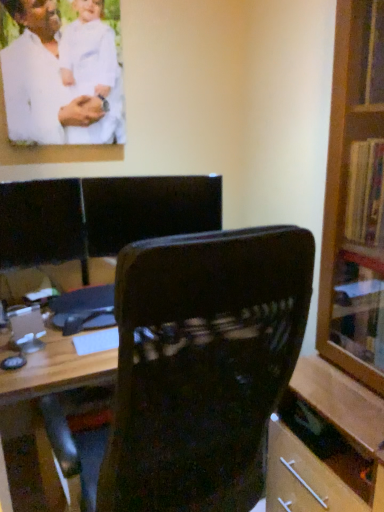
Question: Is white matte shirt at upper left taller than velvet-like dark brown chair at center?

Choices:
 (A) no
 (B) yes

Answer: (A)

Question: Is white matte shirt at upper left located outside velvet-like dark brown chair at center?

Choices:
 (A) no
 (B) yes

Answer: (B)

Question: Can you confirm if white matte shirt at upper left is shorter than velvet-like dark brown chair at center?

Choices:
 (A) no
 (B) yes

Answer: (B)

Question: From the image's perspective, is white matte shirt at upper left on top of velvet-like dark brown chair at center?

Choices:
 (A) no
 (B) yes

Answer: (B)

Question: Is white matte shirt at upper left positioned in front of velvet-like dark brown chair at center?

Choices:
 (A) no
 (B) yes

Answer: (A)

Question: Is black leather chair at center situated inside white matte shirt at upper left or outside?

Choices:
 (A) outside
 (B) inside

Answer: (A)

Question: Does point (210, 227) appear closer or farther from the camera than point (41, 33)?

Choices:
 (A) farther
 (B) closer

Answer: (A)

Question: From their relative heights in the image, would you say black leather chair at center is taller or shorter than white matte shirt at upper left?

Choices:
 (A) short
 (B) tall

Answer: (A)

Question: Is black leather chair at center bigger or smaller than white matte shirt at upper left?

Choices:
 (A) small
 (B) big

Answer: (B)

Question: Considering the positions of black leather chair at center and velvet-like dark brown chair at center in the image, is black leather chair at center wider or thinner than velvet-like dark brown chair at center?

Choices:
 (A) thin
 (B) wide

Answer: (A)

Question: Is black leather chair at center in front of or behind velvet-like dark brown chair at center in the image?

Choices:
 (A) front
 (B) behind

Answer: (B)

Question: Do you think black leather chair at center is within velvet-like dark brown chair at center, or outside of it?

Choices:
 (A) inside
 (B) outside

Answer: (B)

Question: From a real-world perspective, is black leather chair at center physically located above or below velvet-like dark brown chair at center?

Choices:
 (A) above
 (B) below

Answer: (A)

Question: Visually, is white matte shirt at upper left positioned to the left or to the right of velvet-like dark brown chair at center?

Choices:
 (A) right
 (B) left

Answer: (B)

Question: Is white matte shirt at upper left in front of or behind velvet-like dark brown chair at center in the image?

Choices:
 (A) front
 (B) behind

Answer: (B)